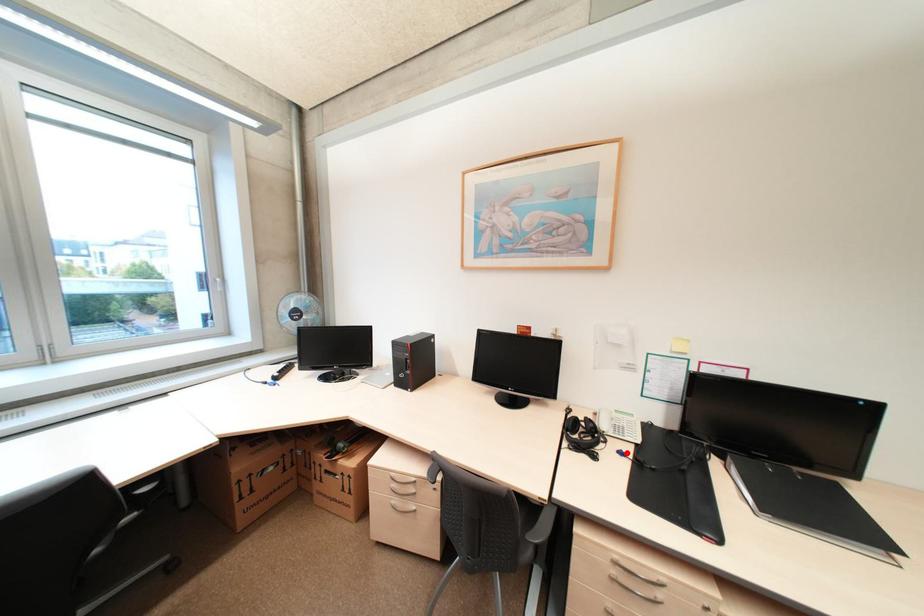
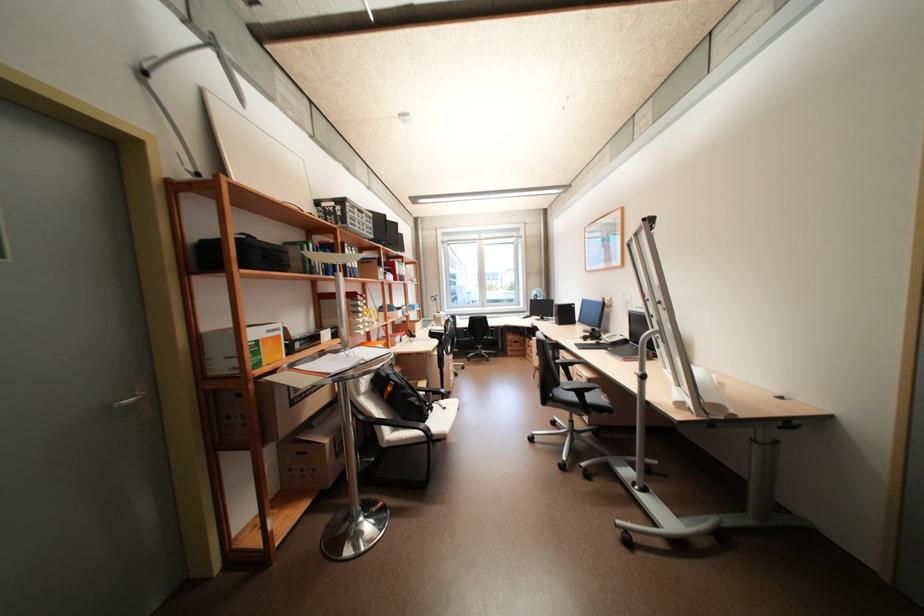
Locate, in the second image, the point that corresponds to the highlighted location in the first image.

(603, 342)